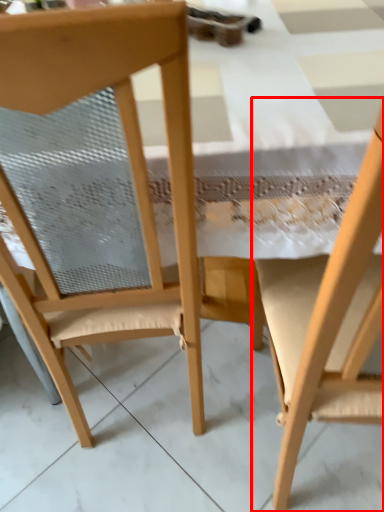
Question: From the image's perspective, considering the relative positions of chair (annotated by the red box) and chair in the image provided, where is chair (annotated by the red box) located with respect to the staircase?

Choices:
 (A) above
 (B) below

Answer: (B)